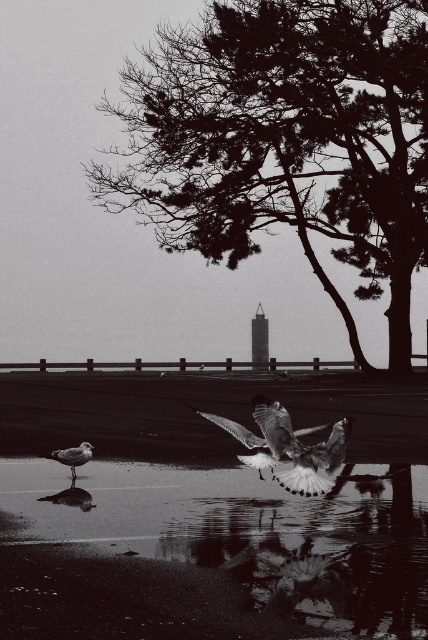
Question: Where is reflective wet sand at lower center located in relation to smooth feathered bird at center in the image?

Choices:
 (A) above
 (B) below

Answer: (B)

Question: Which point is closer to the camera?

Choices:
 (A) white feathered bird at lower left
 (B) white feathered bird at center

Answer: (B)

Question: Which is nearer to the white feathered bird at center?

Choices:
 (A) white feathered bird at lower left
 (B) smooth feathered bird at center
 (C) reflective wet sand at lower center

Answer: (B)

Question: Which is nearer to the white feathered bird at center?

Choices:
 (A) white feathered bird at lower left
 (B) silhouette textured tree at upper center

Answer: (A)

Question: Can you confirm if silhouette textured tree at upper center is smaller than smooth feathered bird at center?

Choices:
 (A) yes
 (B) no

Answer: (B)

Question: Does reflective wet sand at lower center lie behind smooth feathered bird at center?

Choices:
 (A) no
 (B) yes

Answer: (A)